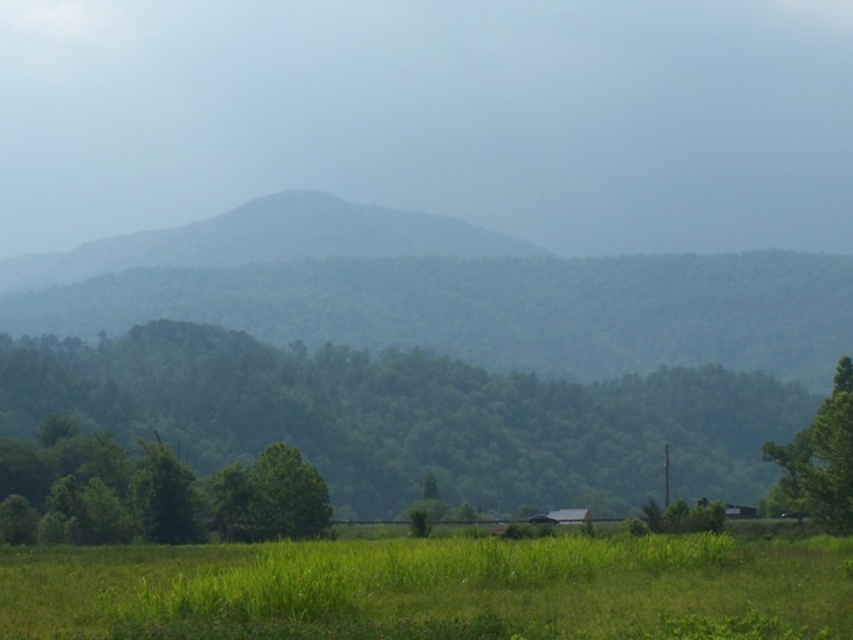
Question: Is green grass at lower center positioned at the back of green leafy tree at right?

Choices:
 (A) no
 (B) yes

Answer: (A)

Question: Which point is farther to the camera?

Choices:
 (A) (x=844, y=525)
 (B) (x=657, y=449)
 (C) (x=141, y=509)

Answer: (B)

Question: Can you confirm if green leafy tree at center is positioned above green leafy tree at right?

Choices:
 (A) yes
 (B) no

Answer: (B)

Question: Which of the following is the farthest from the observer?

Choices:
 (A) green leafy tree at lower left
 (B) green leafy tree at right
 (C) green grass at lower center

Answer: (A)

Question: Which of these objects is positioned farthest from the green leafy tree at lower left?

Choices:
 (A) green leafy tree at right
 (B) green leafy tree at center

Answer: (B)

Question: Can you confirm if green leafy tree at center is positioned above green leafy tree at right?

Choices:
 (A) no
 (B) yes

Answer: (A)